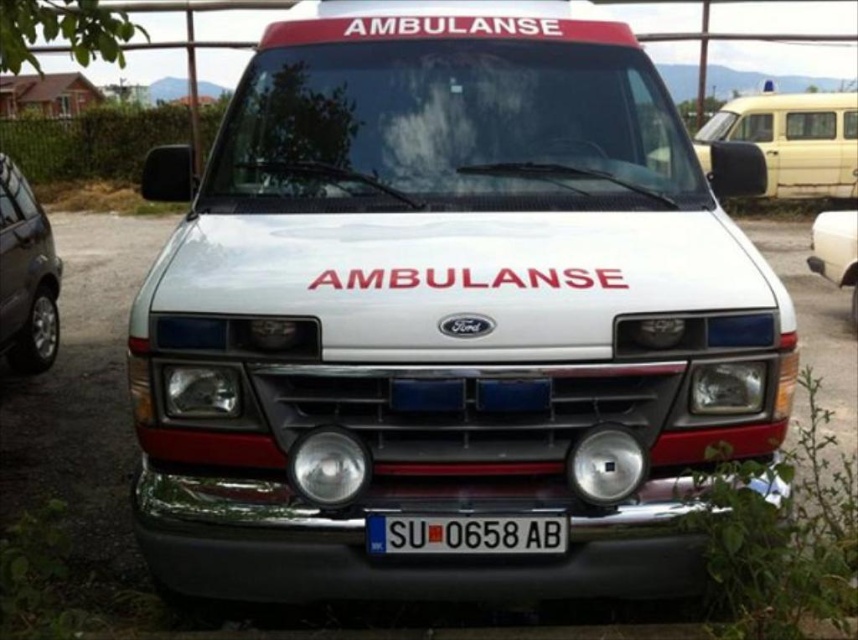
Question: Which object appears farthest from the camera in this image?

Choices:
 (A) yellow matte van at right
 (B) white plastic license plate at center
 (C) white glossy van at center

Answer: (C)

Question: Which point is farther to the camera?

Choices:
 (A) metallic gray car at left
 (B) yellow matte van at right

Answer: (A)

Question: Can you confirm if white plastic license plate at center is thinner than white glossy van at center?

Choices:
 (A) no
 (B) yes

Answer: (A)

Question: Which point is farther to the camera?

Choices:
 (A) (808, 120)
 (B) (40, 257)
 (C) (415, 532)
 (D) (855, 276)

Answer: (A)

Question: Can you confirm if yellow matte van at right is thinner than white glossy van at center?

Choices:
 (A) yes
 (B) no

Answer: (B)

Question: Observing the image, what is the correct spatial positioning of metallic gray car at left in reference to white plastic license plate at center?

Choices:
 (A) right
 (B) left

Answer: (B)